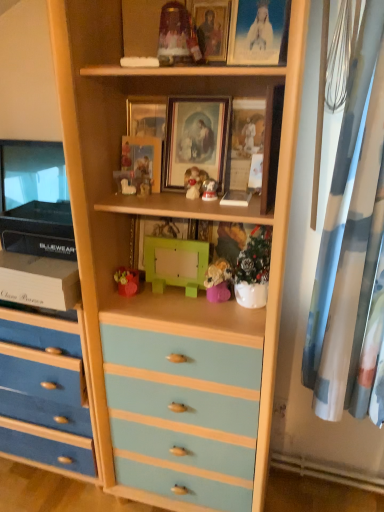
Question: Are matte glass jar at upper center, arranged as the first toy when viewed from the top, and matte gold picture frame at upper center, the 1th picture frame in the right-to-left sequence, far apart?

Choices:
 (A) no
 (B) yes

Answer: (A)

Question: Is matte glass jar at upper center, the 2th toy when ordered from left to right, positioned in front of matte gold picture frame at upper center, the 1th picture frame in the right-to-left sequence?

Choices:
 (A) yes
 (B) no

Answer: (B)

Question: Is matte glass jar at upper center, arranged as the first toy when viewed from the top, taller than matte gold picture frame at upper center, the 1th picture frame in the right-to-left sequence?

Choices:
 (A) yes
 (B) no

Answer: (B)

Question: From the image's perspective, is matte glass jar at upper center, which is counted as the fourth toy, starting from the right, under matte gold picture frame at upper center, the 1th picture frame in the right-to-left sequence?

Choices:
 (A) yes
 (B) no

Answer: (A)

Question: Considering the relative positions of matte glass jar at upper center, which is the fifth toy in bottom-to-top order, and matte gold picture frame at upper center, the 1th picture frame in the right-to-left sequence, in the image provided, is matte glass jar at upper center, which is the fifth toy in bottom-to-top order, behind matte gold picture frame at upper center, the 1th picture frame in the right-to-left sequence,?

Choices:
 (A) yes
 (B) no

Answer: (A)

Question: From a real-world perspective, is matte gold picture frame at upper center, the 1th picture frame in the right-to-left sequence, above or below satin gold figurine at center, the second toy positioned from the right?

Choices:
 (A) above
 (B) below

Answer: (A)

Question: Does point (269, 46) appear closer or farther from the camera than point (215, 185)?

Choices:
 (A) closer
 (B) farther

Answer: (A)

Question: Choose the correct answer: Is matte gold picture frame at upper center, the fifth picture frame positioned from the left, inside satin gold figurine at center, acting as the third toy starting from the top, or outside it?

Choices:
 (A) outside
 (B) inside

Answer: (A)

Question: Is matte gold picture frame at upper center, the 1th picture frame in the right-to-left sequence, taller or shorter than satin gold figurine at center, acting as the third toy starting from the top?

Choices:
 (A) short
 (B) tall

Answer: (B)

Question: From a real-world perspective, is matte porcelain figurine at center, marked as the 2th toy in a top-to-bottom arrangement, above or below wooden picture frame at upper center, placed as the second picture frame when sorted from right to left?

Choices:
 (A) below
 (B) above

Answer: (A)

Question: Is matte porcelain figurine at center, the 3th toy viewed from the left, inside the boundaries of wooden picture frame at upper center, placed as the second picture frame when sorted from right to left, or outside?

Choices:
 (A) outside
 (B) inside

Answer: (A)

Question: Is matte porcelain figurine at center, the third toy when ordered from right to left, wider or thinner than wooden picture frame at upper center, acting as the fourth picture frame starting from the left?

Choices:
 (A) wide
 (B) thin

Answer: (A)

Question: Does point (185, 170) appear closer or farther from the camera than point (213, 16)?

Choices:
 (A) farther
 (B) closer

Answer: (A)

Question: Considering the relative positions of satin gold figurine at center, which is the fourth toy in left-to-right order, and matte red plush toy at center, the 5th toy viewed from the right, in the image provided, is satin gold figurine at center, which is the fourth toy in left-to-right order, to the left or to the right of matte red plush toy at center, the 5th toy viewed from the right,?

Choices:
 (A) left
 (B) right

Answer: (B)

Question: From the image's perspective, relative to matte red plush toy at center, the 5th toy viewed from the right, is satin gold figurine at center, acting as the third toy starting from the top, above or below?

Choices:
 (A) below
 (B) above

Answer: (B)